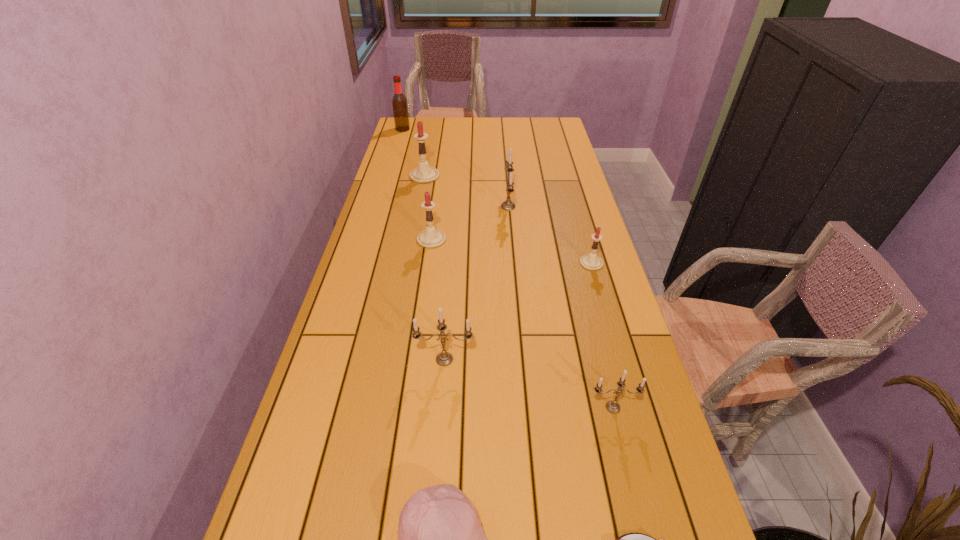
The image size is (960, 540). Identify the location of red candle that is the second closest to the beer bottle. (430, 238).

Where is `red candle object that ranks as the closest to the leftmost object`? The image size is (960, 540). red candle object that ranks as the closest to the leftmost object is located at coordinates (423, 174).